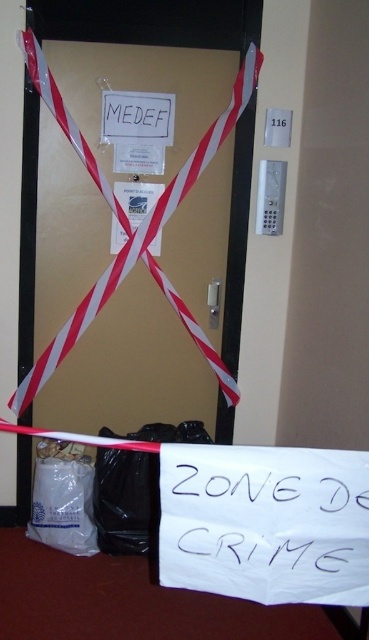
Between white paper at lower center and white plastic bag at lower left, which one is positioned lower?

white plastic bag at lower left

Based on the photo, can you confirm if white paper at lower center is wider than white plastic bag at lower left?

Correct, the width of white paper at lower center exceeds that of white plastic bag at lower left.

Where is `white paper at lower center`? white paper at lower center is located at coordinates (x=267, y=513).

The height and width of the screenshot is (640, 369). What do you see at coordinates (129, 225) in the screenshot?
I see `red/white striped tape at center` at bounding box center [129, 225].

Can you confirm if red/white striped tape at center is wider than white plastic bag at lower left?

Correct, the width of red/white striped tape at center exceeds that of white plastic bag at lower left.

At what (x,y) coordinates should I click in order to perform the action: click on red/white striped tape at center. Please return your answer as a coordinate pair (x, y). The image size is (369, 640). Looking at the image, I should click on (129, 225).

I want to click on white plastic bag at lower left, so click(x=63, y=499).

Is point (77, 504) farther from camera compared to point (129, 129)?

No, it is not.

Where is `white plastic bag at lower left`? This screenshot has width=369, height=640. white plastic bag at lower left is located at coordinates (63, 499).